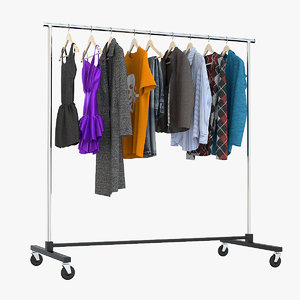
Locate an element on the screen. This screenshot has height=300, width=300. hangers is located at coordinates (227, 48), (209, 45), (192, 46), (174, 46), (150, 45), (133, 41), (114, 42), (96, 41), (70, 37).